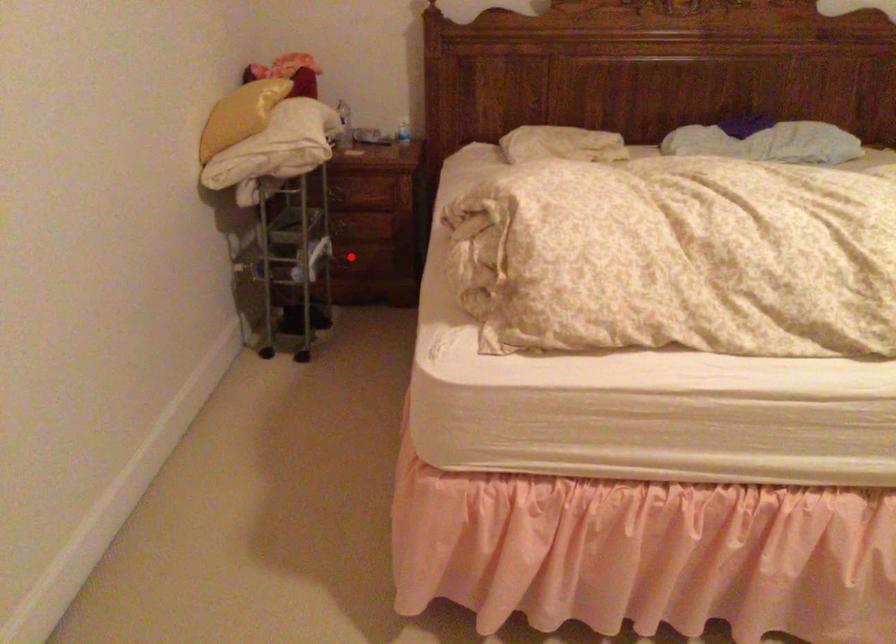
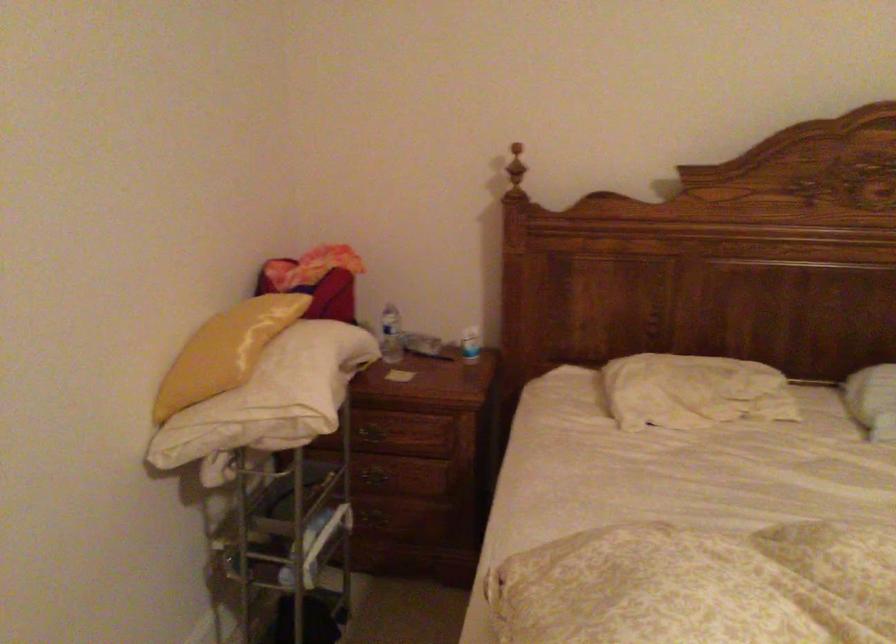
Find the pixel in the second image that matches the highlighted location in the first image.

(381, 516)